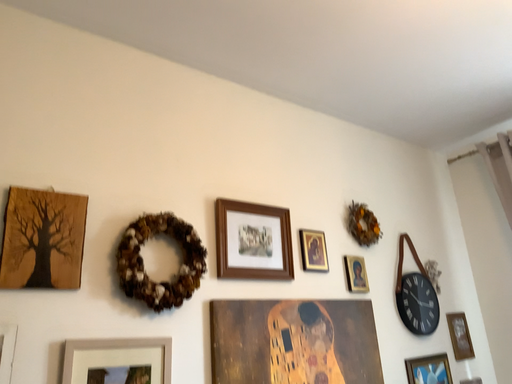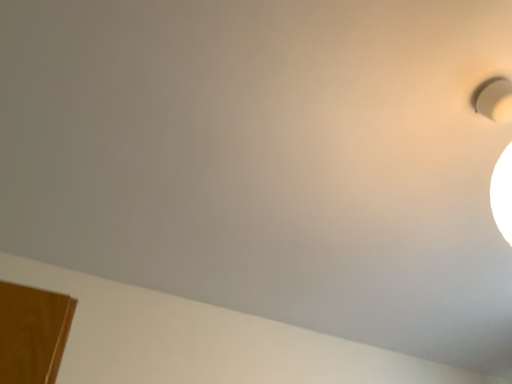
Question: Which way did the camera rotate in the video?

Choices:
 (A) rotated upward
 (B) rotated downward

Answer: (A)